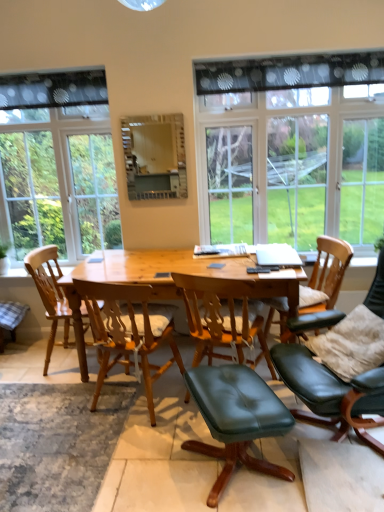
Where is `free point to the left of green leather stool at lower center`? The image size is (384, 512). free point to the left of green leather stool at lower center is located at coordinates (139, 466).